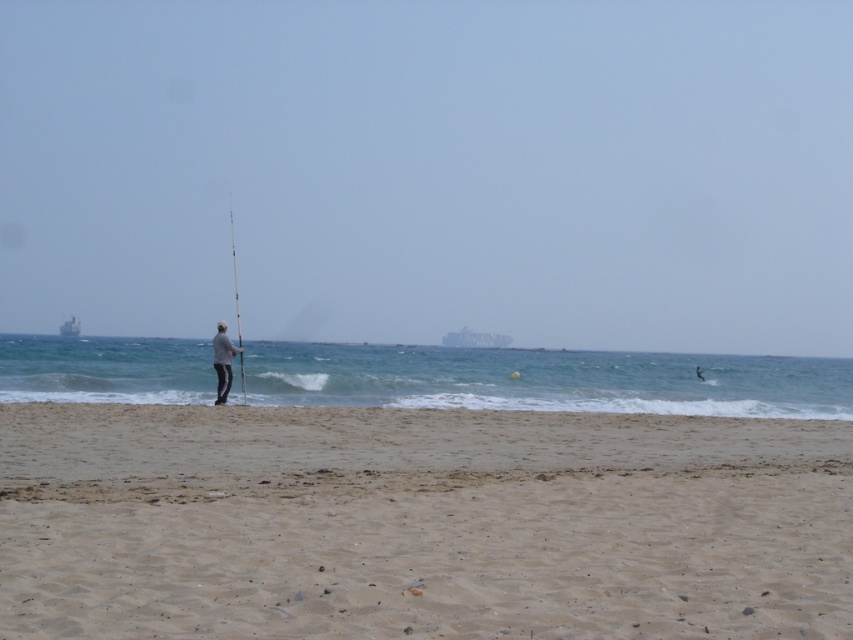
Question: Estimate the real-world distances between objects in this image. Which object is closer to the smooth black pole at center?

Choices:
 (A) light gray fabric jacket at center
 (B) fine-grained sand at lower center

Answer: (A)

Question: Is the position of fine-grained sand at lower center more distant than that of light gray fabric jacket at center?

Choices:
 (A) no
 (B) yes

Answer: (A)

Question: Which object is the farthest from the smooth black pole at center?

Choices:
 (A) light gray fabric jacket at center
 (B) fine-grained sand at lower center

Answer: (B)

Question: Can you confirm if fine-grained sand at lower center is bigger than smooth black pole at center?

Choices:
 (A) yes
 (B) no

Answer: (B)

Question: Where is fine-grained sand at lower center located in relation to light gray fabric jacket at center in the image?

Choices:
 (A) left
 (B) right

Answer: (B)

Question: Which point is closer to the camera?

Choices:
 (A) light gray fabric jacket at center
 (B) smooth black pole at center
 (C) fine-grained sand at lower center

Answer: (C)